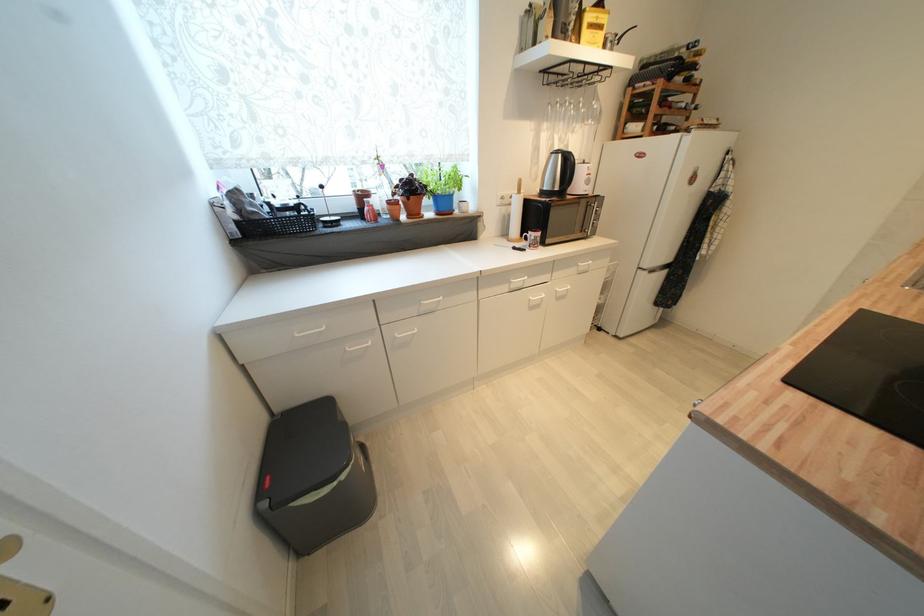
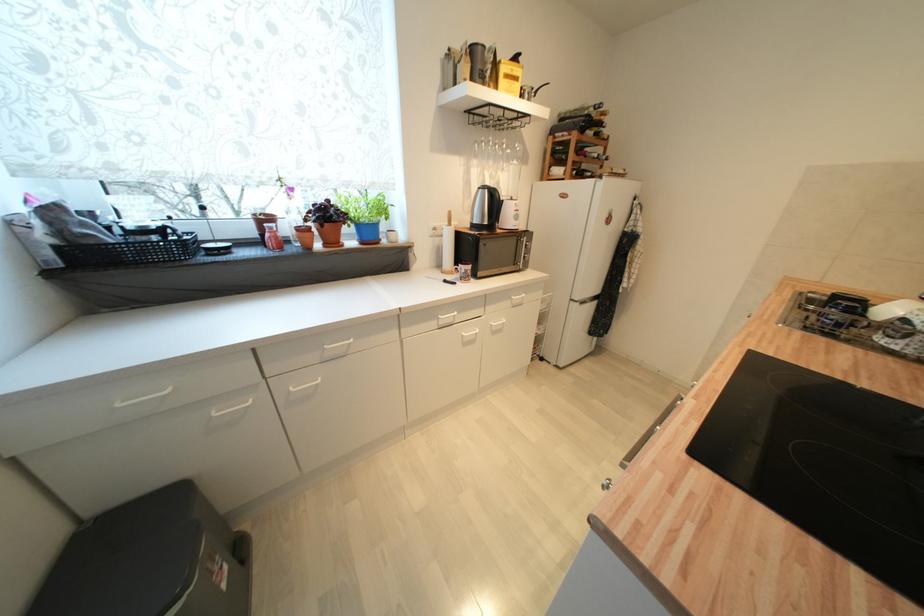
Where in the second image is the point corresponding to point (566, 285) from the first image?

(502, 318)